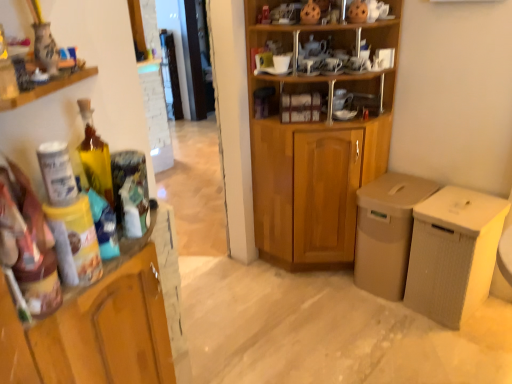
Locate an element on the screen. The width and height of the screenshot is (512, 384). vacant space situated on the left part of wooden cupboard at center is located at coordinates (239, 289).